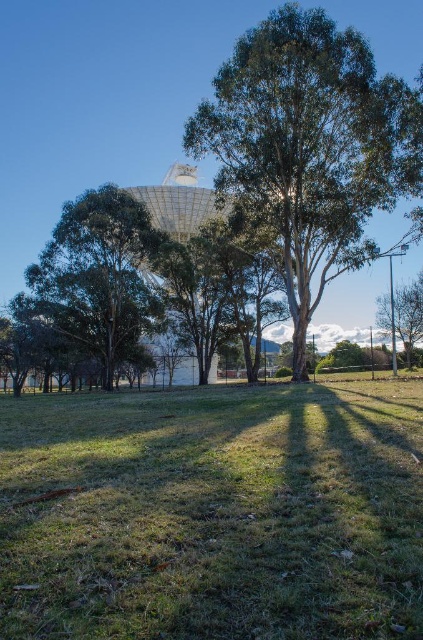
Question: Among these points, which one is nearest to the camera?

Choices:
 (A) (230, 124)
 (B) (324, 458)
 (C) (411, 298)

Answer: (B)

Question: Among these points, which one is nearest to the camera?

Choices:
 (A) (115, 282)
 (B) (379, 320)

Answer: (A)

Question: Is green grass at center smaller than green leafy tree at center?

Choices:
 (A) no
 (B) yes

Answer: (B)

Question: Estimate the real-world distances between objects in this image. Which object is closer to the green leafy tree at left?

Choices:
 (A) green grass at center
 (B) green leafy tree at center
 (C) green leafy tree at right

Answer: (B)

Question: Is the position of green leafy tree at left more distant than that of green leafy tree at right?

Choices:
 (A) yes
 (B) no

Answer: (B)

Question: Does green leafy tree at left appear on the left side of green leafy tree at right?

Choices:
 (A) yes
 (B) no

Answer: (A)